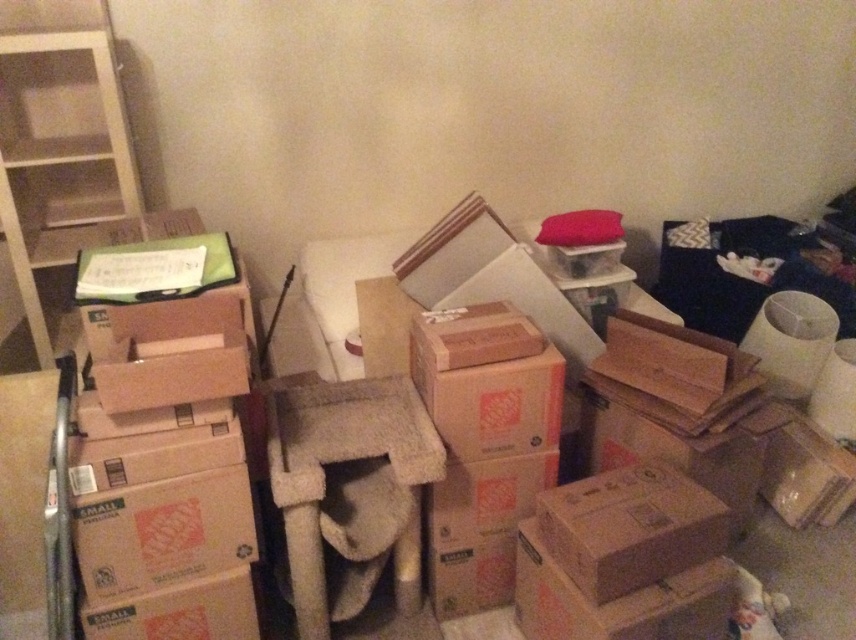
You are a delivery person who just arrived with a new package that needs to be placed in this storage area. The package is 60 centimeters long. You see the brown cardboard box at left and the white wood bookshelf at upper left. Can you fit the package between them without moving either object?

The distance between the brown cardboard box at left and the white wood bookshelf at upper left is 63.17 centimeters. Since the package is 60 centimeters long, it can fit between them as the space is slightly larger than the package.

You are trying to place a new bookshelf in the room. You see the brown cardboard box at left and the white wood bookshelf at upper left. Which object is closer to the right side of the room?

The brown cardboard box at left is positioned on the right side of the white wood bookshelf at upper left, so it is closer to the right side of the room.